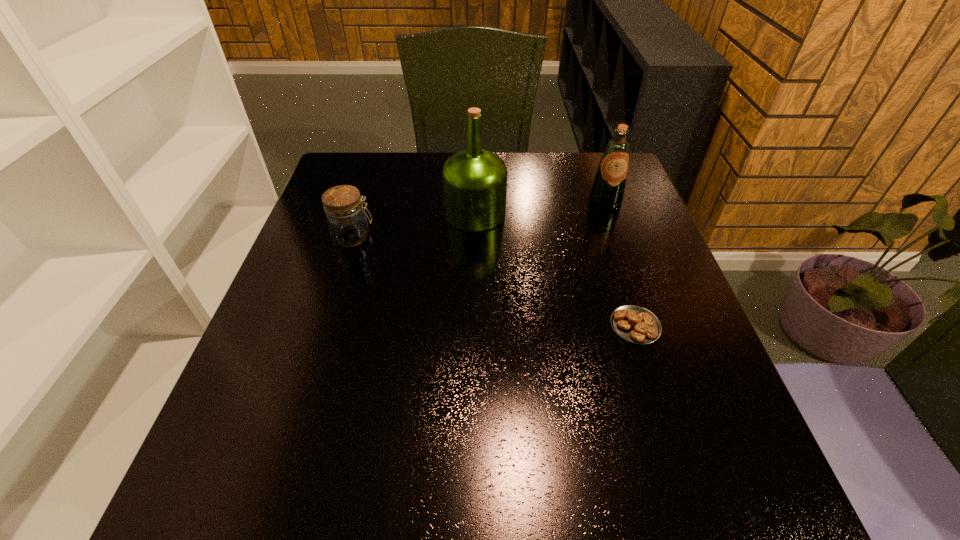
Identify the location of the tallest object. The height and width of the screenshot is (540, 960). (474, 180).

This screenshot has width=960, height=540. In order to click on the left olive oil in this screenshot , I will do `click(474, 180)`.

Identify the location of the shorter olive oil. Image resolution: width=960 pixels, height=540 pixels. (608, 189).

You are a GUI agent. You are given a task and a screenshot of the screen. Output one action in this format:
    pyautogui.click(x=<x>, y=<y>)
    Task: Click on the right olive oil
    The height and width of the screenshot is (540, 960).
    Given the screenshot: What is the action you would take?
    pyautogui.click(x=608, y=189)

Where is `jar`? The height and width of the screenshot is (540, 960). jar is located at coordinates (347, 222).

What are the coordinates of `the second shortest object` in the screenshot? It's located at [347, 222].

The height and width of the screenshot is (540, 960). I want to click on the shortest object, so [x=635, y=324].

Locate an element on the screen. Image resolution: width=960 pixels, height=540 pixels. pastry is located at coordinates (635, 324).

Find the location of `vacant region located 0.240m on the left of the tallest object`. vacant region located 0.240m on the left of the tallest object is located at coordinates (351, 213).

Identify the location of vacant region located 0.140m on the front-facing side of the right olive oil. The image size is (960, 540). (621, 249).